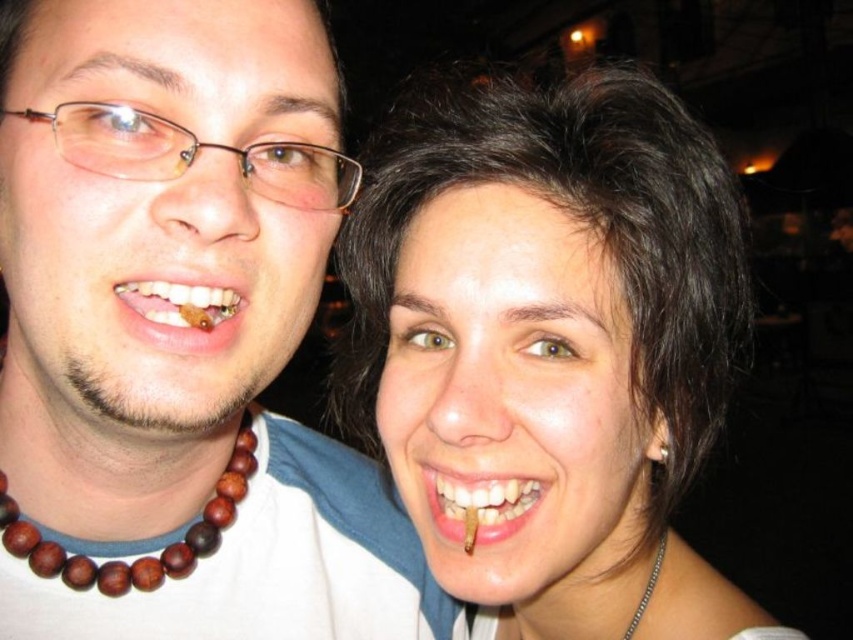
Consider the image. Which of these two, dark brown hair at upper right or teeth with brown stain at lower center, stands taller?

dark brown hair at upper right is taller.

Is dark brown hair at upper right above teeth with brown stain at lower center?

Correct, dark brown hair at upper right is located above teeth with brown stain at lower center.

I want to click on dark brown hair at upper right, so click(553, 342).

Find the location of a particular element. The width and height of the screenshot is (853, 640). dark brown hair at upper right is located at coordinates (553, 342).

Who is more forward, [566,296] or [236,449]?

Point [566,296] is in front.

In the scene shown: Does dark brown hair at upper right have a lesser height compared to brown wooden beads at left?

No, dark brown hair at upper right is not shorter than brown wooden beads at left.

You are a GUI agent. You are given a task and a screenshot of the screen. Output one action in this format:
    pyautogui.click(x=<x>, y=<y>)
    Task: Click on the dark brown hair at upper right
    This screenshot has height=640, width=853.
    Given the screenshot: What is the action you would take?
    pyautogui.click(x=553, y=342)

At what (x,y) coordinates should I click in order to perform the action: click on dark brown hair at upper right. Please return your answer as a coordinate pair (x, y). The height and width of the screenshot is (640, 853). Looking at the image, I should click on (553, 342).

Is wooden bead necklace at left taller than brown wood toothpick at lower left?

Yes, wooden bead necklace at left is taller than brown wood toothpick at lower left.

Is wooden bead necklace at left thinner than brown wood toothpick at lower left?

No.

Does point (90, 150) lie in front of point (212, 326)?

Yes, point (90, 150) is in front of point (212, 326).

Identify the location of wooden bead necklace at left. The height and width of the screenshot is (640, 853). (152, 244).